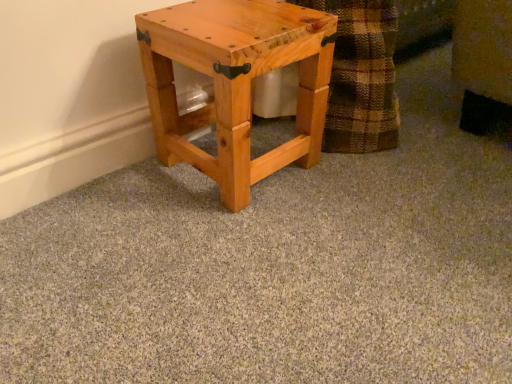
I want to click on vacant space situated on the left part of natural wood stool at lower center, so click(x=121, y=188).